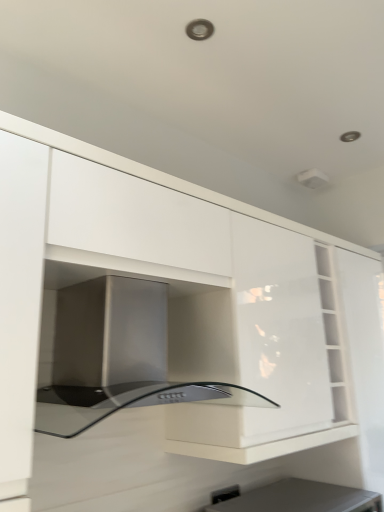
Question: Should I look upward or downward to see black plastic electric outlet at lower center?

Choices:
 (A) up
 (B) down

Answer: (B)

Question: Can we say black plastic electric outlet at lower center lies outside stainless steel oven at center?

Choices:
 (A) no
 (B) yes

Answer: (B)

Question: From the image's perspective, is black plastic electric outlet at lower center located above stainless steel oven at center?

Choices:
 (A) yes
 (B) no

Answer: (B)

Question: Is black plastic electric outlet at lower center taller than stainless steel oven at center?

Choices:
 (A) no
 (B) yes

Answer: (A)

Question: Is black plastic electric outlet at lower center closer to the viewer compared to stainless steel oven at center?

Choices:
 (A) no
 (B) yes

Answer: (A)

Question: Is black plastic electric outlet at lower center looking in the opposite direction of stainless steel oven at center?

Choices:
 (A) no
 (B) yes

Answer: (A)

Question: Considering the relative sizes of black plastic electric outlet at lower center and stainless steel oven at center in the image provided, is black plastic electric outlet at lower center shorter than stainless steel oven at center?

Choices:
 (A) yes
 (B) no

Answer: (A)

Question: Considering the relative positions of stainless steel oven at center and matte black appliance at lower center in the image provided, is stainless steel oven at center to the right of matte black appliance at lower center from the viewer's perspective?

Choices:
 (A) yes
 (B) no

Answer: (B)

Question: From the image's perspective, is stainless steel oven at center on matte black appliance at lower center?

Choices:
 (A) yes
 (B) no

Answer: (A)

Question: Can you confirm if stainless steel oven at center is shorter than matte black appliance at lower center?

Choices:
 (A) yes
 (B) no

Answer: (B)

Question: Is stainless steel oven at center far from matte black appliance at lower center?

Choices:
 (A) yes
 (B) no

Answer: (B)

Question: Does stainless steel oven at center have a lesser width compared to matte black appliance at lower center?

Choices:
 (A) yes
 (B) no

Answer: (A)

Question: Considering the relative sizes of stainless steel oven at center and matte black appliance at lower center in the image provided, is stainless steel oven at center bigger than matte black appliance at lower center?

Choices:
 (A) yes
 (B) no

Answer: (A)

Question: Is stainless steel oven at center bigger than black plastic electric outlet at lower center?

Choices:
 (A) no
 (B) yes

Answer: (B)